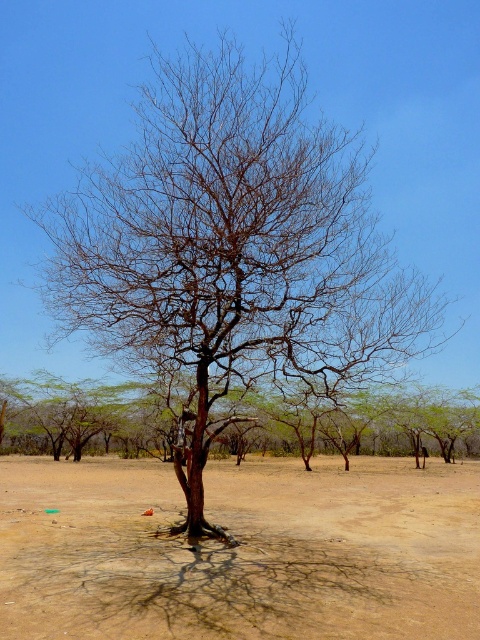
You are standing at the base of the barren tree in the image and notice a small point marked at coordinates point (240, 552). Based on the scene, where is this point located relative to the barren tree?

The point (240, 552) is on brown sandy dirt at center, which is the ground area around the barren tree.

You are standing in the dry landscape looking at the brown sandy dirt at center and the brown bark tree at center. Which object is closer to the ground?

The brown sandy dirt at center is closer to the ground as it is located below the brown bark tree at center.

You are a hiker trying to determine the best spot to set up a tent. You notice the brown sandy dirt at center and the brown bark tree at center in the image. Which location would provide a more stable foundation for your tent, and why?

The brown sandy dirt at center has a smaller size compared to brown bark tree at center. Therefore, the brown bark tree at center would provide a more stable foundation for the tent because its larger size suggests it has deeper roots, which can anchor the ground more effectively.